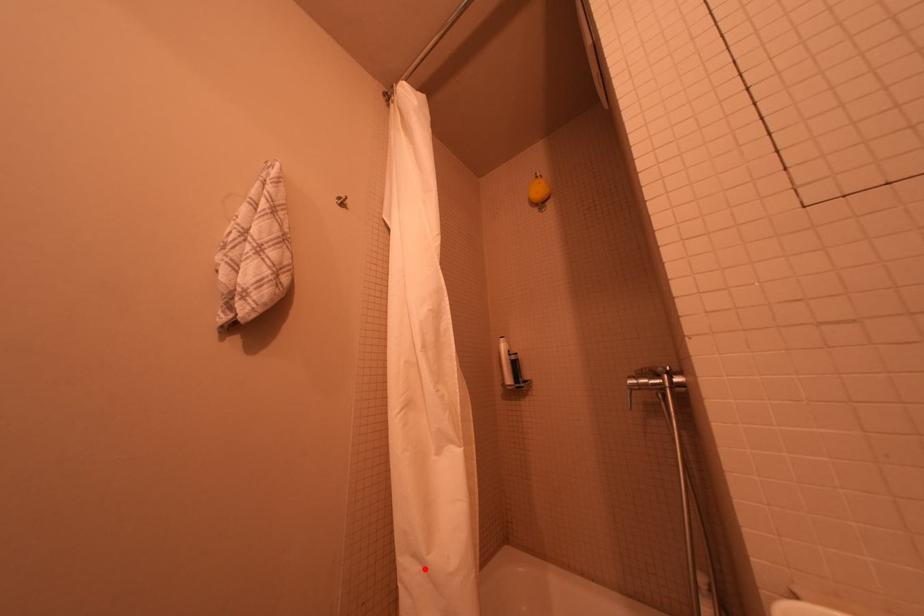
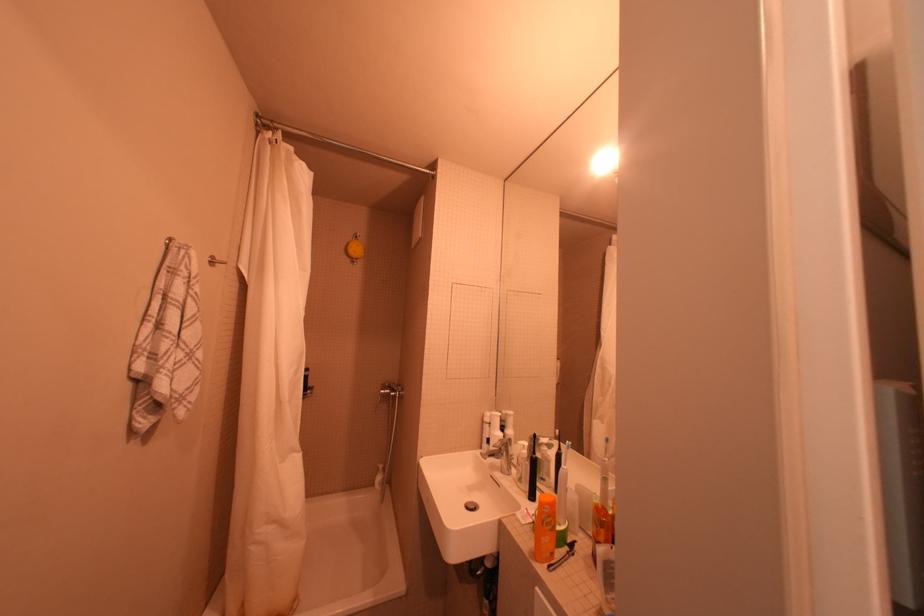
Locate, in the second image, the point that corresponds to the highlighted location in the first image.

(281, 528)